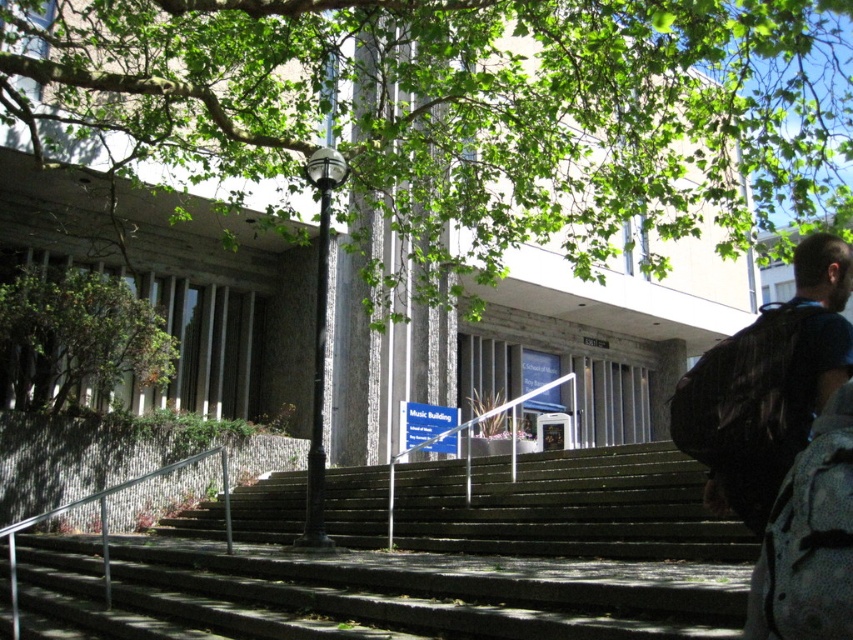
Who is positioned more to the right, green leafy tree at upper center or dark blue backpack at right?

Positioned to the right is green leafy tree at upper center.

Does green leafy tree at upper center have a smaller size compared to dark blue backpack at right?

No.

Which is in front, point (691, 88) or point (776, 324)?

Point (776, 324)

This screenshot has width=853, height=640. Identify the location of green leafy tree at upper center. (468, 106).

Is green wooden stairs at center smaller than matte black backpack at right?

No.

Does point (566, 465) lie behind point (735, 369)?

Yes.

Identify the location of green wooden stairs at center. (567, 508).

Does green concrete stairs at center have a larger size compared to matte black backpack at right?

Correct, green concrete stairs at center is larger in size than matte black backpack at right.

Is point (399, 566) farther from camera compared to point (811, 392)?

That is True.

Where is `green concrete stairs at center`? This screenshot has width=853, height=640. green concrete stairs at center is located at coordinates (418, 557).